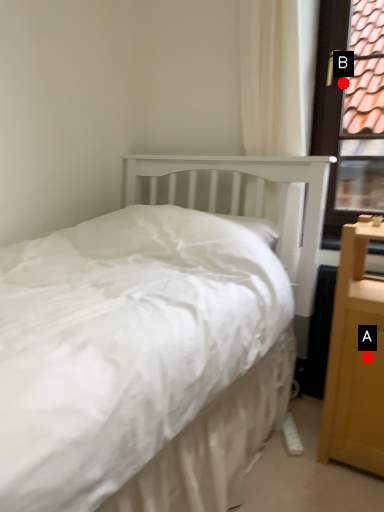
Question: Two points are circled on the image, labeled by A and B beside each circle. Which point appears farthest from the camera in this image?

Choices:
 (A) A is further
 (B) B is further

Answer: (B)